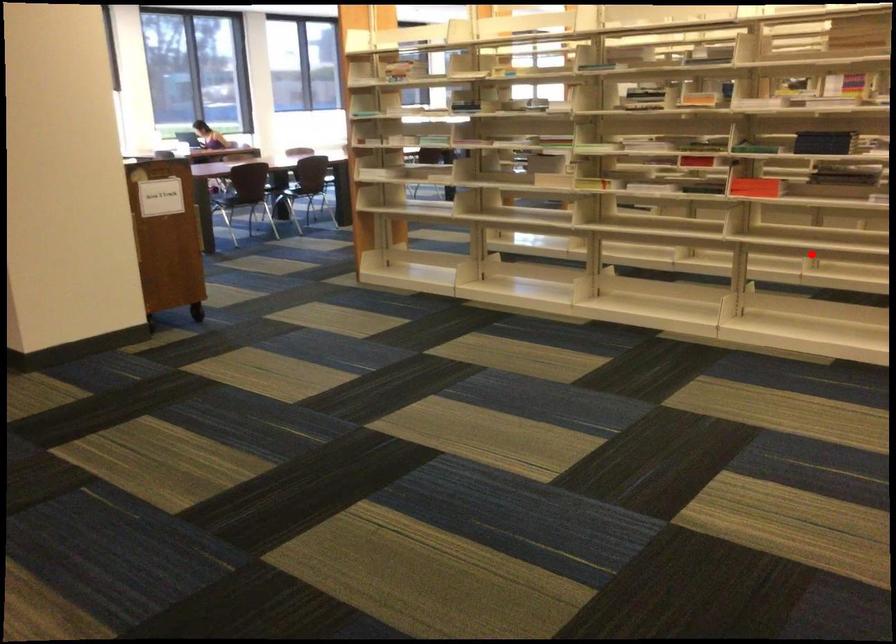
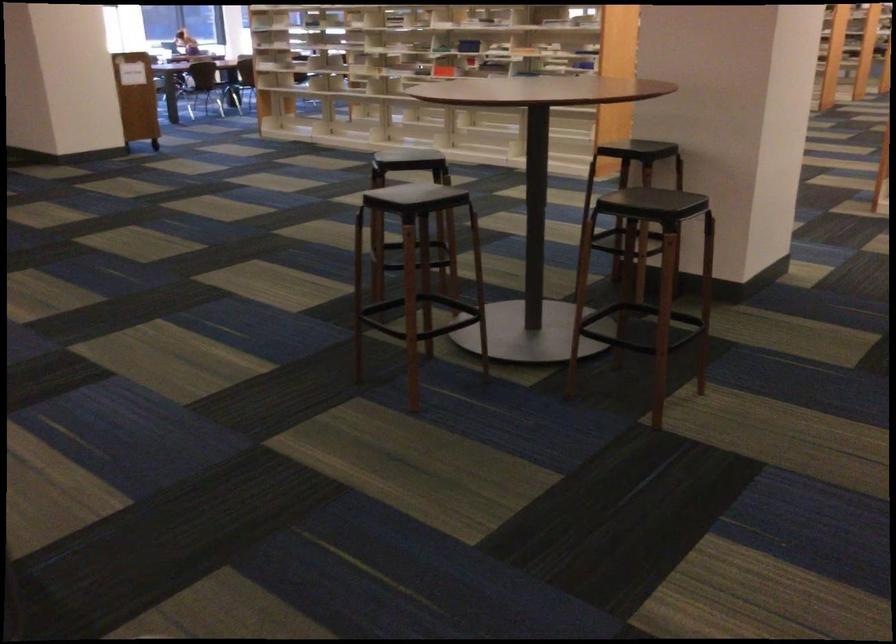
The point at the highlighted location is marked in the first image. Where is the corresponding point in the second image?

(443, 71)